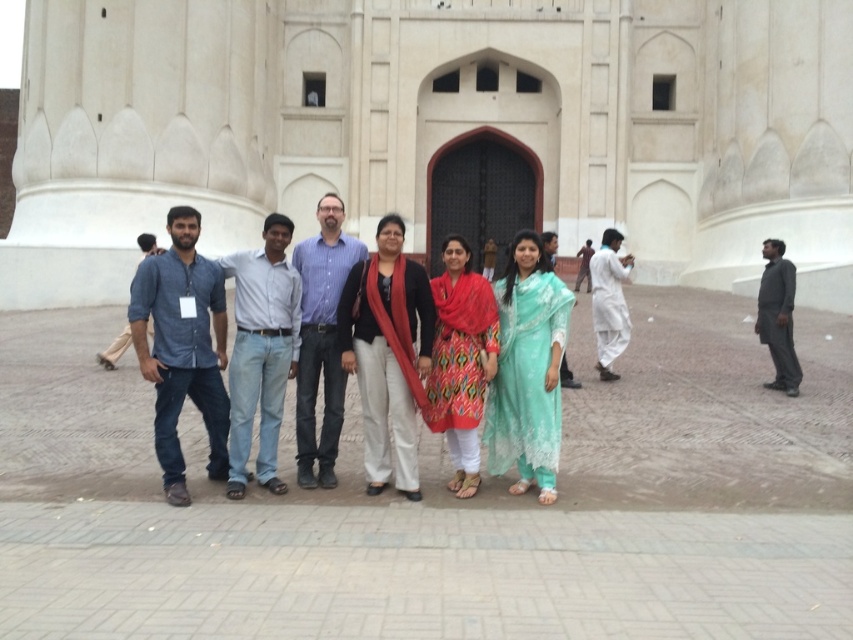
Is printed cotton dress at center to the right of white cotton kurta at center from the viewer's perspective?

No, printed cotton dress at center is not to the right of white cotton kurta at center.

In the scene shown: Who is more forward, (451, 442) or (602, 236)?

Point (451, 442)

Identify the location of printed cotton dress at center. click(460, 360).

Locate an element on the screen. The width and height of the screenshot is (853, 640). printed cotton dress at center is located at coordinates (460, 360).

Looking at this image, between printed cotton dress at center and dark gray fabric at right, which one appears on the left side from the viewer's perspective?

printed cotton dress at center

In order to click on printed cotton dress at center in this screenshot , I will do `click(460, 360)`.

This screenshot has height=640, width=853. I want to click on printed cotton dress at center, so 460,360.

Does teal silk salwar kameez at center have a lesser width compared to white cotton kurta at center?

Correct, teal silk salwar kameez at center's width is less than white cotton kurta at center's.

Is point (534, 346) positioned before point (614, 275)?

Yes, it is.

The height and width of the screenshot is (640, 853). I want to click on teal silk salwar kameez at center, so pos(527,369).